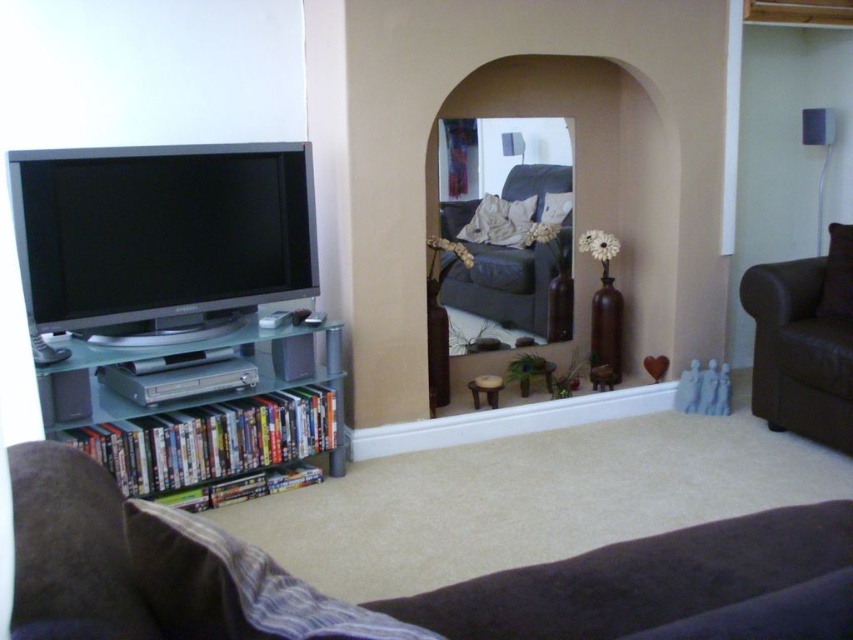
This screenshot has height=640, width=853. What do you see at coordinates (213, 417) in the screenshot?
I see `clear plastic bookshelf at left` at bounding box center [213, 417].

Between clear plastic bookshelf at left and leather couch at center, which one appears on the right side from the viewer's perspective?

From the viewer's perspective, leather couch at center appears more on the right side.

Locate an element on the screen. clear plastic bookshelf at left is located at coordinates (213, 417).

Where is `clear glass entertainment center at left`? This screenshot has width=853, height=640. clear glass entertainment center at left is located at coordinates (178, 310).

Who is more distant from viewer, (x=177, y=362) or (x=450, y=204)?

Point (x=450, y=204)

Between point (50, 404) and point (453, 228), which one is positioned behind?

The point (453, 228) is more distant.

Locate an element on the screen. clear glass entertainment center at left is located at coordinates (178, 310).

Is brown leather armchair at right taller than leather couch at center?

Yes.

Who is shorter, brown leather armchair at right or leather couch at center?

Standing shorter between the two is leather couch at center.

Where is `brown leather armchair at right`? This screenshot has height=640, width=853. brown leather armchair at right is located at coordinates (804, 342).